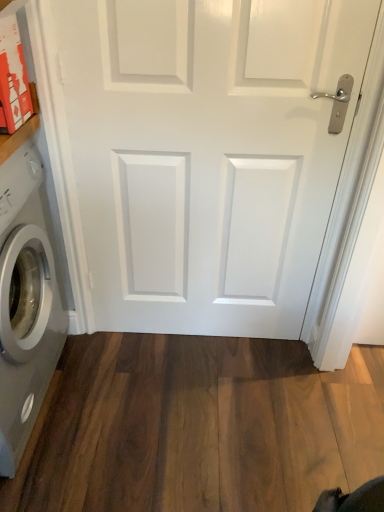
Locate an element on the screen. This screenshot has width=384, height=512. free space to the left of white glossy door at center is located at coordinates (124, 369).